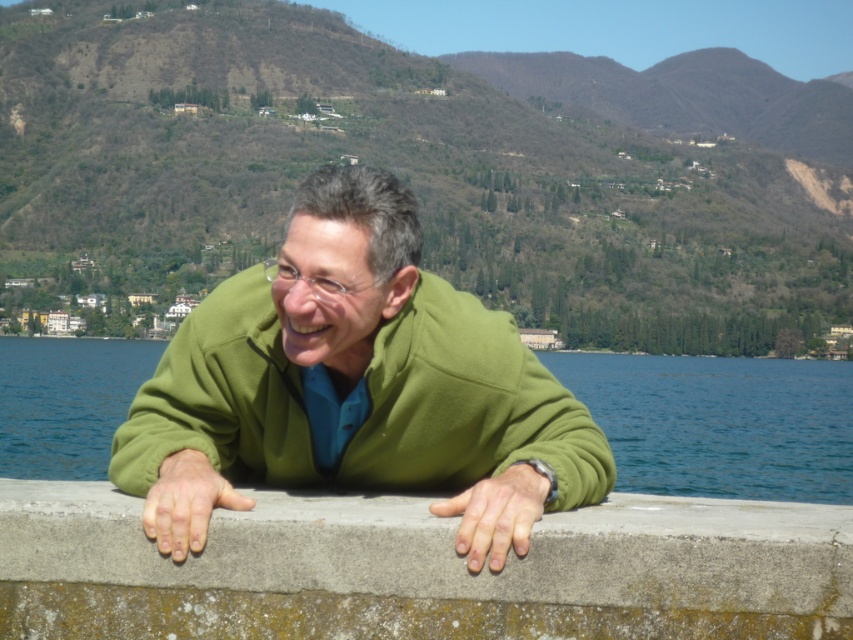
Question: Which of the following is the closest to the observer?

Choices:
 (A) (80, 596)
 (B) (831, 472)

Answer: (A)

Question: Can you confirm if gray concrete ledge at center is thinner than blue water at center?

Choices:
 (A) no
 (B) yes

Answer: (B)

Question: Can you confirm if green matte jacket at center is positioned to the right of gray concrete ledge at center?

Choices:
 (A) no
 (B) yes

Answer: (A)

Question: Which point is closer to the camera taking this photo?

Choices:
 (A) (213, 304)
 (B) (363, 602)

Answer: (B)

Question: Can you confirm if green matte jacket at center is smaller than blue water at center?

Choices:
 (A) yes
 (B) no

Answer: (A)

Question: Which object is the closest to the green matte jacket at center?

Choices:
 (A) blue water at center
 (B) gray concrete ledge at center

Answer: (B)